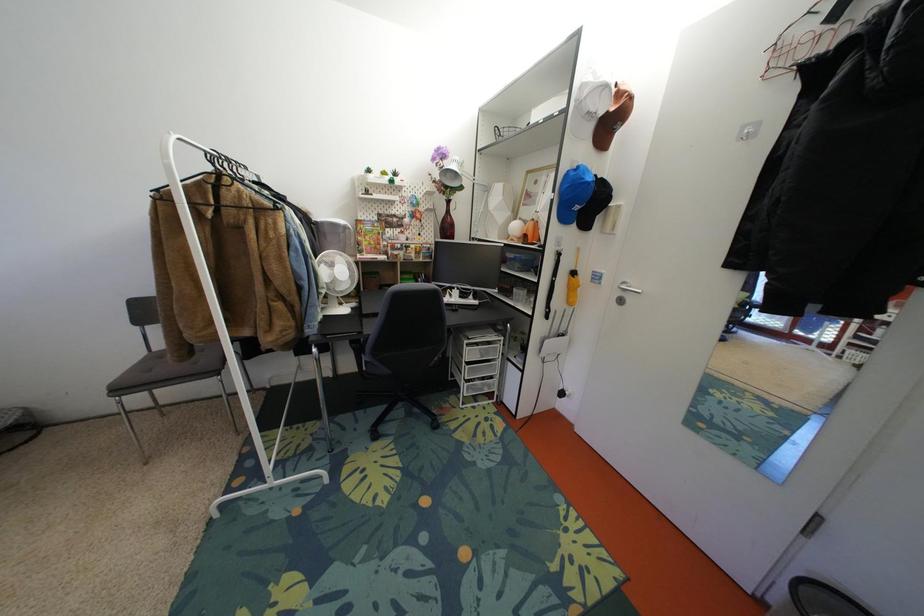
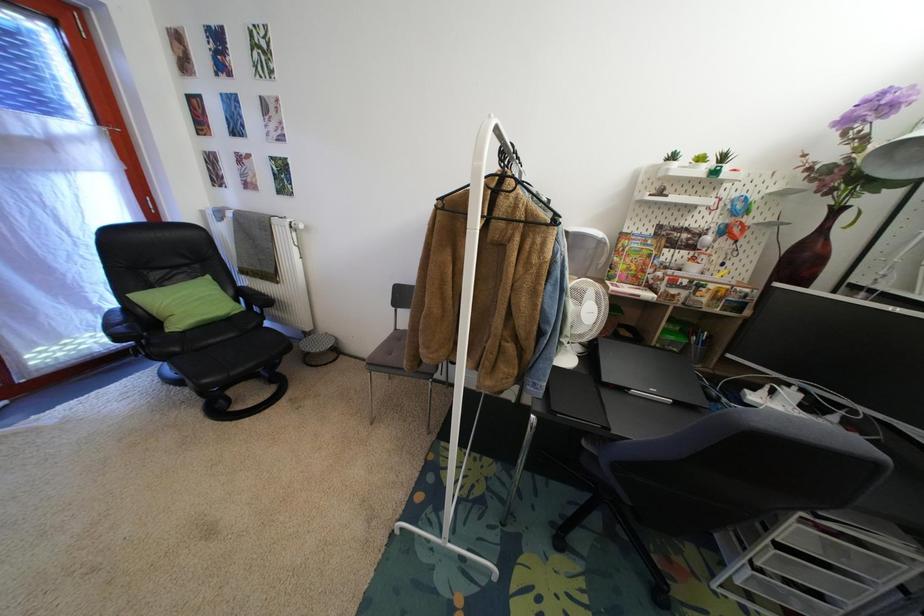
Question: How did the camera likely rotate?

Choices:
 (A) Left
 (B) Right
 (C) Up
 (D) Down

Answer: (A)